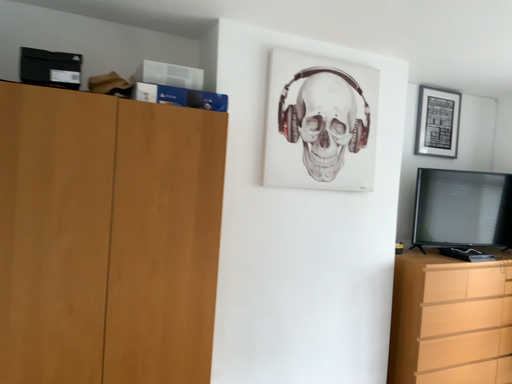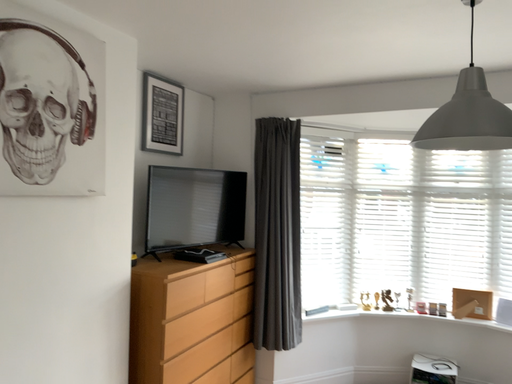
Question: How did the camera likely rotate when shooting the video?

Choices:
 (A) rotated right
 (B) rotated left

Answer: (A)